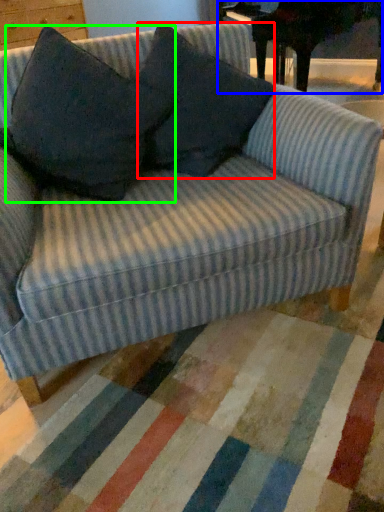
Question: Which object is positioned closest to throw pillow (highlighted by a red box)? Select from table (highlighted by a blue box) and throw pillow (highlighted by a green box).

Choices:
 (A) table
 (B) throw pillow

Answer: (B)